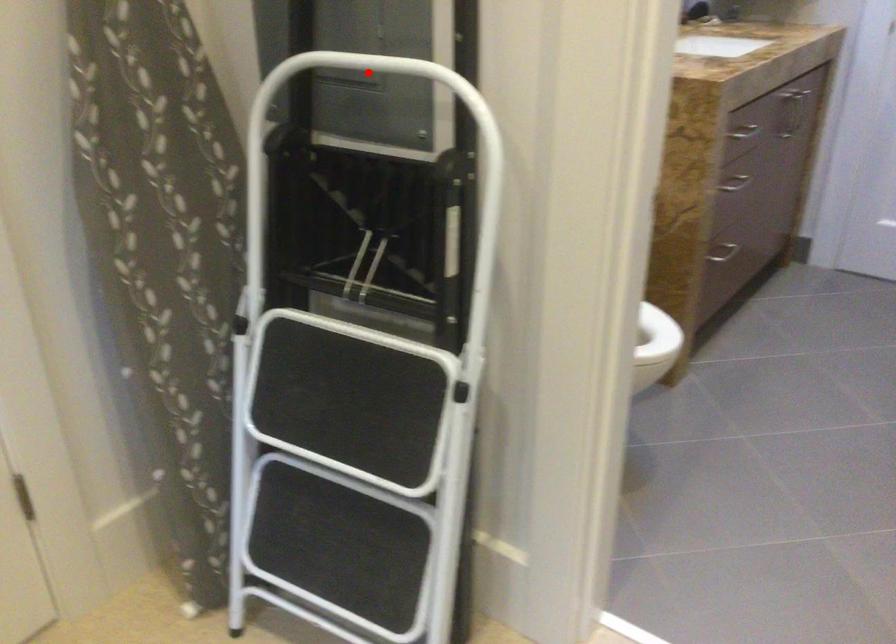
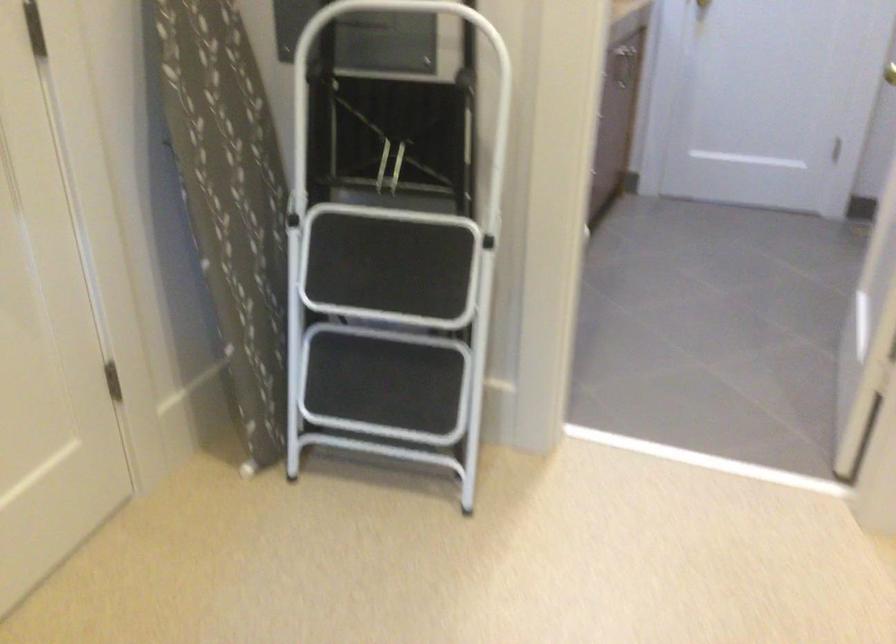
Question: I am providing you with two images of the same scene from different viewpoints. Given a red point in image1, look at the same physical point in image2. Is it:

Choices:
 (A) Closer to the viewpoint
 (B) Farther from the viewpoint

Answer: (B)